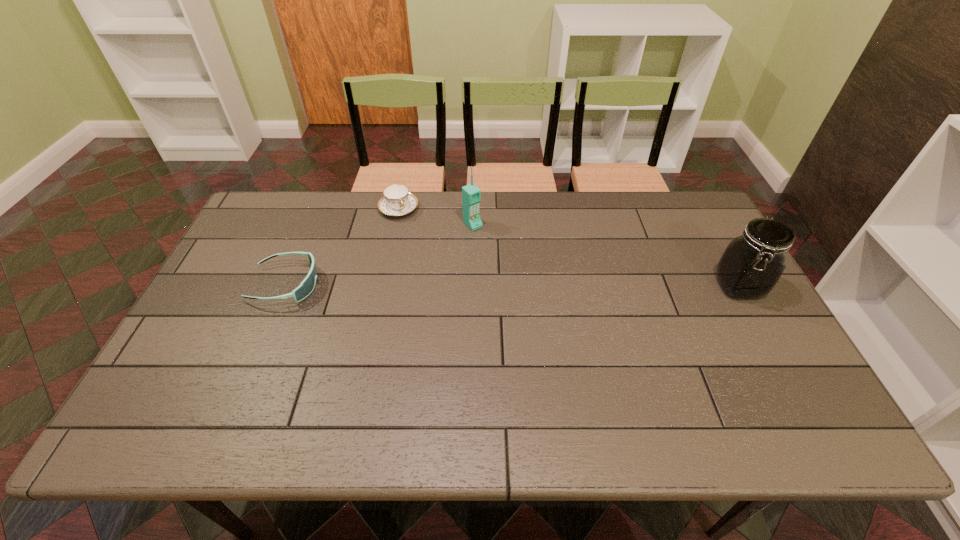
In order to click on goggles in this screenshot , I will do `click(307, 285)`.

Find the location of a particular element. The image size is (960, 540). the rightmost object is located at coordinates (751, 265).

Where is `cellular telephone`? cellular telephone is located at coordinates pyautogui.click(x=471, y=195).

The width and height of the screenshot is (960, 540). Identify the location of teacup. (397, 201).

Find the location of a particular element. vacant space located on the front-facing side of the goggles is located at coordinates (348, 285).

The width and height of the screenshot is (960, 540). I want to click on vacant area situated 0.260m on the lid of the rightmost object, so click(x=797, y=392).

Where is `free space located on the keypad of the cellular telephone`? Image resolution: width=960 pixels, height=540 pixels. free space located on the keypad of the cellular telephone is located at coordinates (557, 307).

Identify the location of free space located 0.100m on the keypad of the cellular telephone. (496, 248).

The image size is (960, 540). In order to click on vacant point located 0.330m on the keypad of the cellular telephone in this screenshot , I will do [543, 294].

The width and height of the screenshot is (960, 540). I want to click on free space located 0.220m on the side with the handle of the teacup, so click(x=431, y=261).